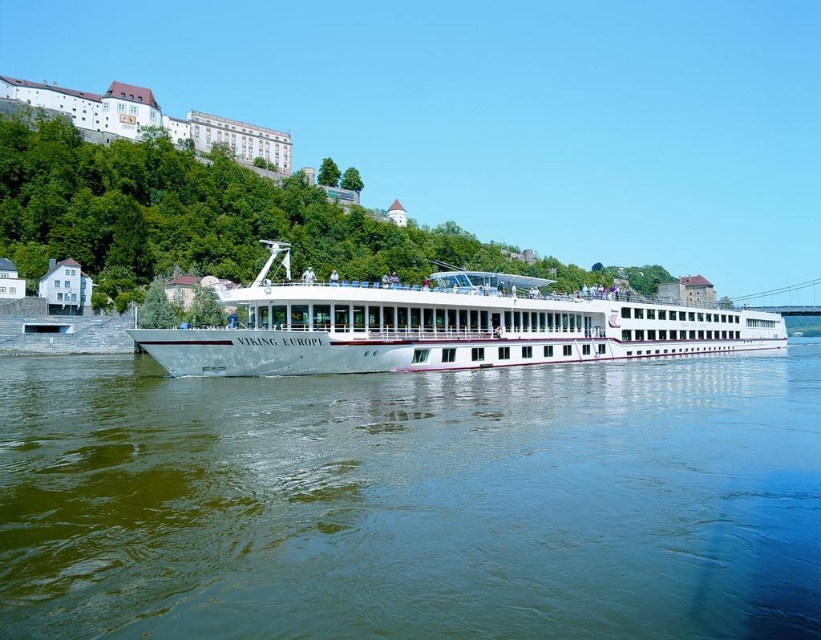
You are standing on the deck of the Viking Europe cruise ship and want to take a photo of the castle on the hillside. You notice two points marked on your map as coordinates. Which point, point (727,560) or point (415,342), is closer to you when facing the direction of the castle?

Point (727,560) is in front of point (415,342), so it is closer to you when facing the direction of the castle.

You are a photographer planning to capture the white glossy cruise ship at center and the greenish water at center in a single frame. Based on their widths, which one will occupy more space horizontally in the photo?

The white glossy cruise ship at center has a greater width than the greenish water at center, so it will occupy more horizontal space in the photo.